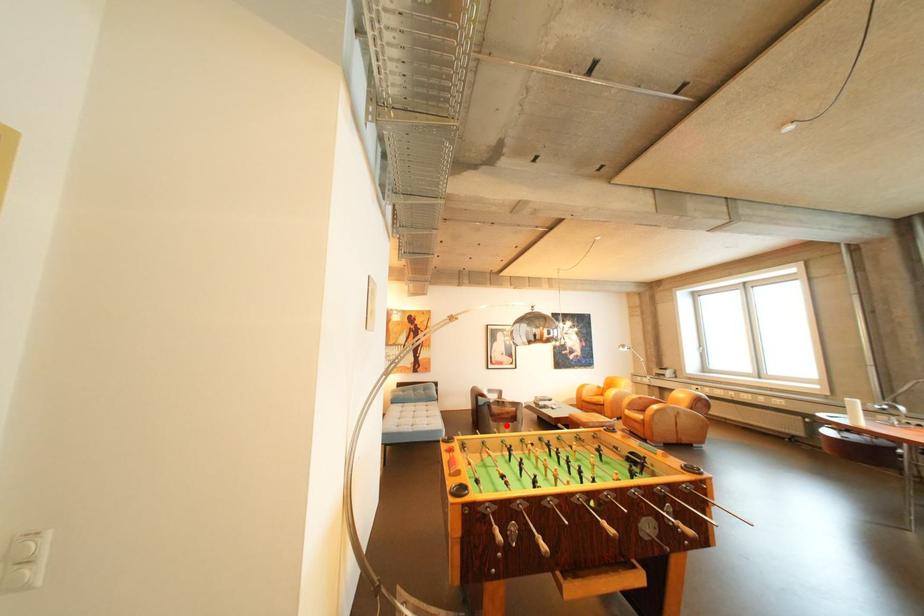
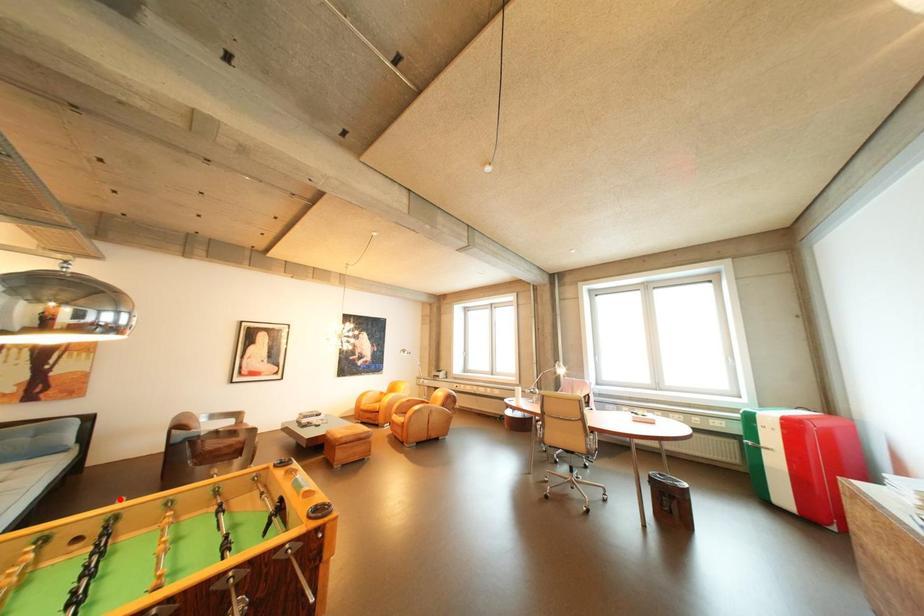
I am providing you with two images of the same scene from different viewpoints. A red point is marked on the first image and another point is marked on the second image. Are the points marked in image1 and image2 representing the same 3D position?

No